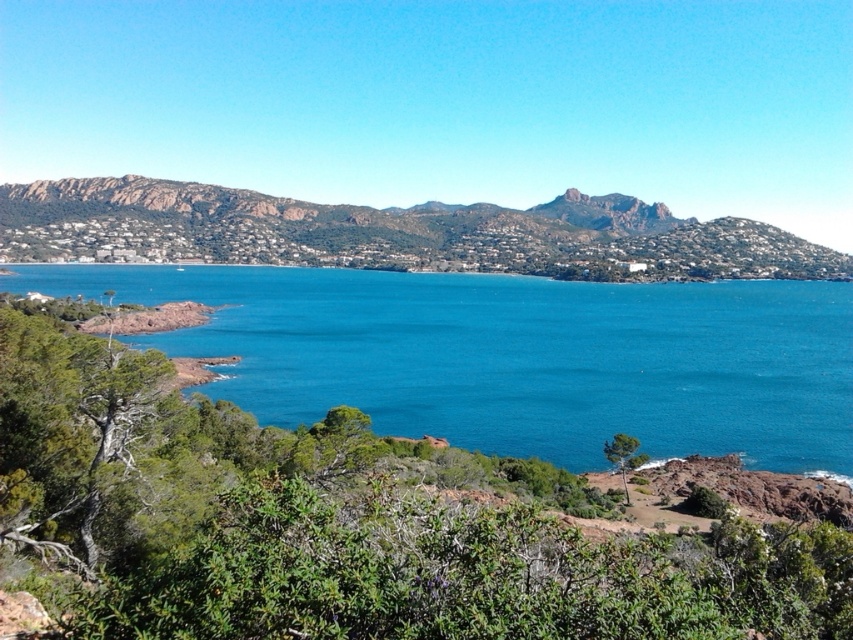
Question: Where is blue water at center located in relation to rustic stone hillside at upper left in the image?

Choices:
 (A) below
 (B) above

Answer: (A)

Question: Does blue water at center have a smaller size compared to rustic stone hillside at upper left?

Choices:
 (A) yes
 (B) no

Answer: (A)

Question: Does blue water at center appear under rustic stone hillside at upper left?

Choices:
 (A) no
 (B) yes

Answer: (B)

Question: Which of the following is the farthest from the observer?

Choices:
 (A) blue water at center
 (B) rustic stone hillside at upper left

Answer: (B)